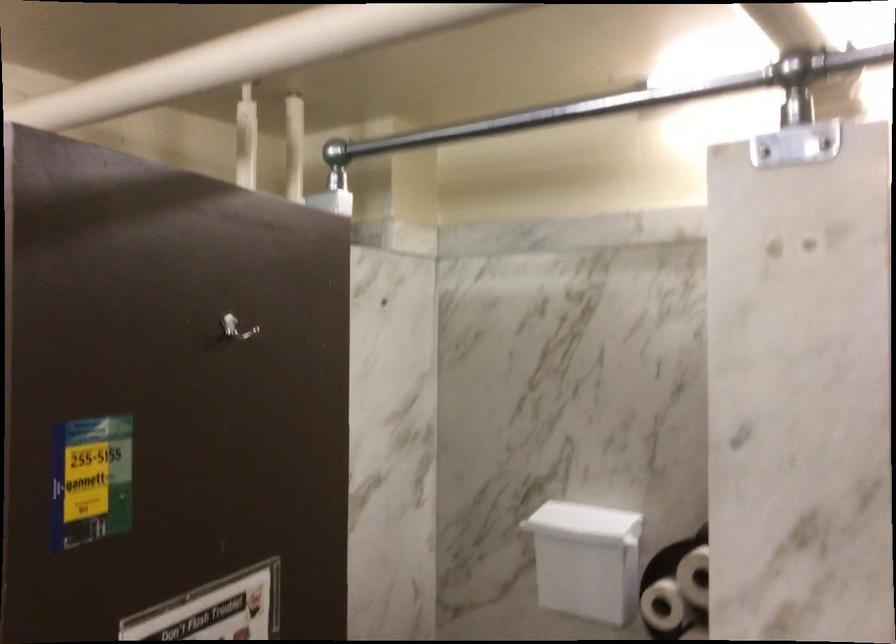
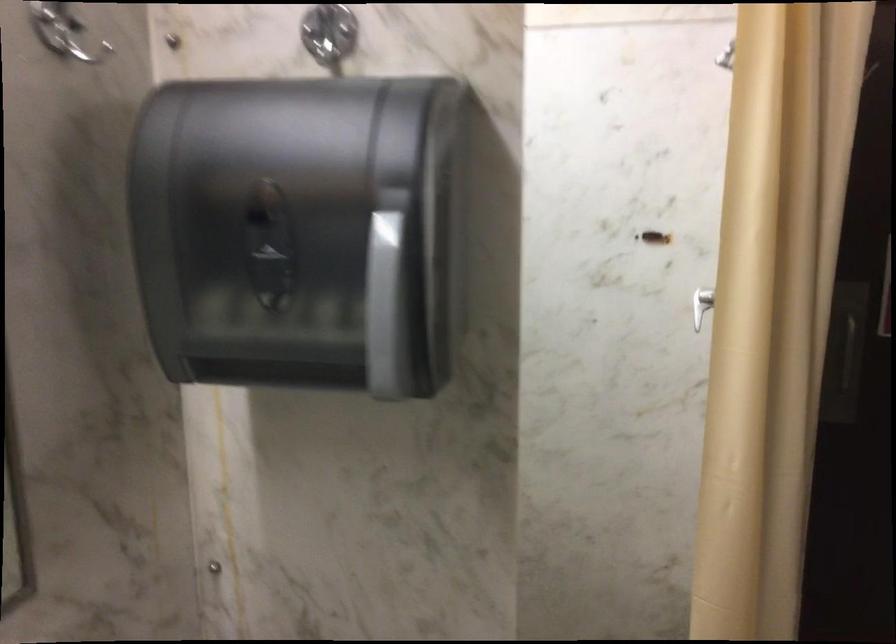
Question: The camera is either moving clockwise (left) or counter-clockwise (right) around the object. The first image is from the beginning of the video and the second image is from the end. Is the camera moving left or right when shooting the video?

Choices:
 (A) Left
 (B) Right

Answer: (B)